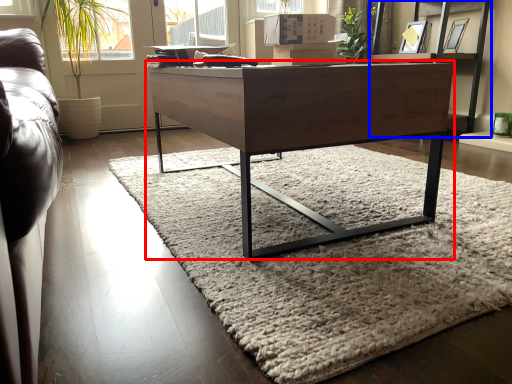
Question: Which object appears closest to the camera in this image, desk (highlighted by a red box) or shelf (highlighted by a blue box)?

Choices:
 (A) desk
 (B) shelf

Answer: (A)